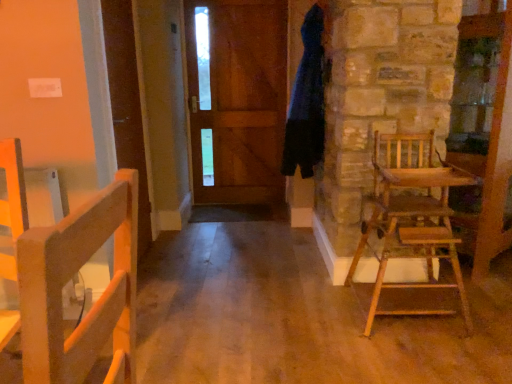
Identify the location of vacant space in front of wooden high chair at right. (432, 355).